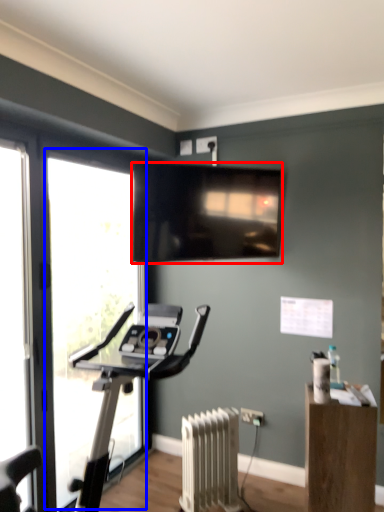
Question: Which object appears closest to the camera in this image, television (highlighted by a red box) or window (highlighted by a blue box)?

Choices:
 (A) television
 (B) window

Answer: (B)